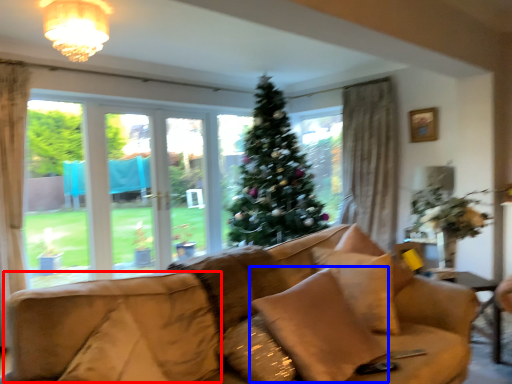
Question: Which object appears farthest to the camera in this image, swivel chair (highlighted by a red box) or pillow (highlighted by a blue box)?

Choices:
 (A) swivel chair
 (B) pillow

Answer: (B)